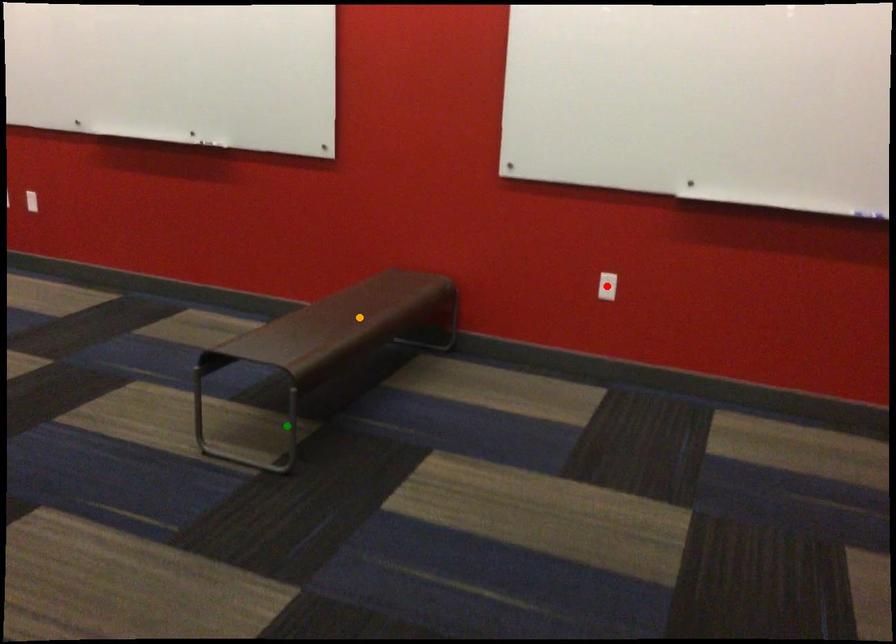
Order these from nearest to farthest:
orange point
green point
red point

green point, orange point, red point